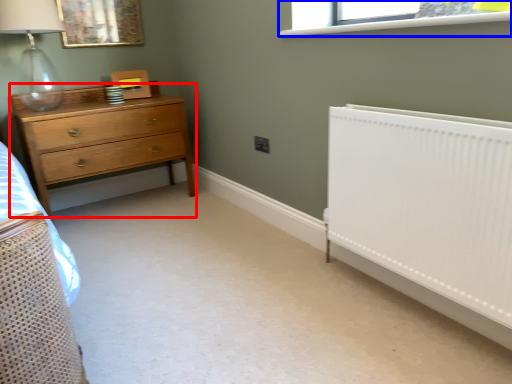
Question: Which of the following is the farthest to the observer, chest of drawers (highlighted by a red box) or window (highlighted by a blue box)?

Choices:
 (A) chest of drawers
 (B) window

Answer: (A)